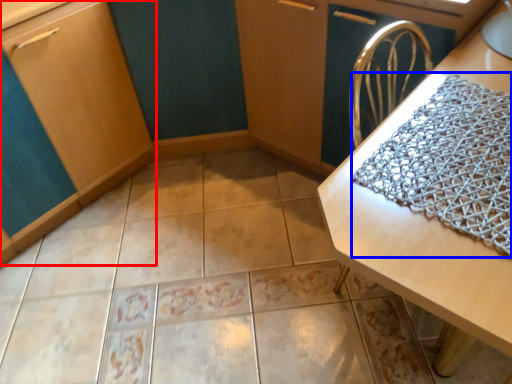
Question: Which point is further to the camera, cabinetry (highlighted by a red box) or blanket (highlighted by a blue box)?

Choices:
 (A) cabinetry
 (B) blanket

Answer: (A)